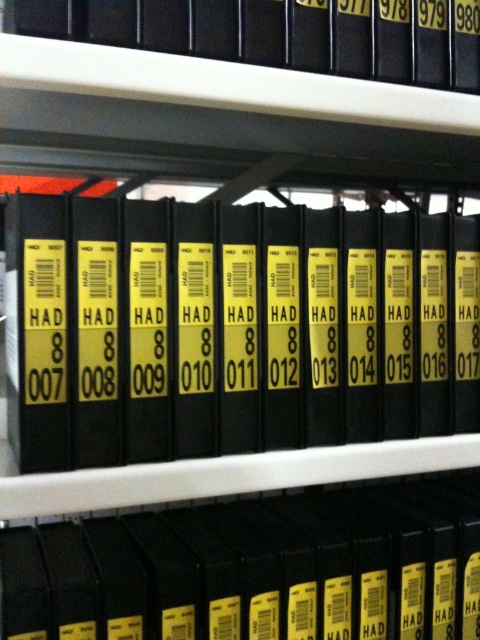
You are organizing files in a library and need to place a new binder between the black matte file at center and the black matte file at upper center. The new binder is 10 inches thick. Is there enough space between them?

The distance between the black matte file at center and the black matte file at upper center is 18.74 inches. Since the new binder is only 10 inches thick, there is sufficient space to place it between them.

You are organizing files in a library and need to place a new binder that is 12 inches tall. The black matte book at center is currently occupying a shelf space. Can the new binder fit in the space where the black matte file at upper center is located?

The black matte book at center is much taller than the black matte file at upper center. Since the new binder is 12 inches tall, it may not fit in the space allocated for the black matte file at upper center if the file is shorter than 12 inches.